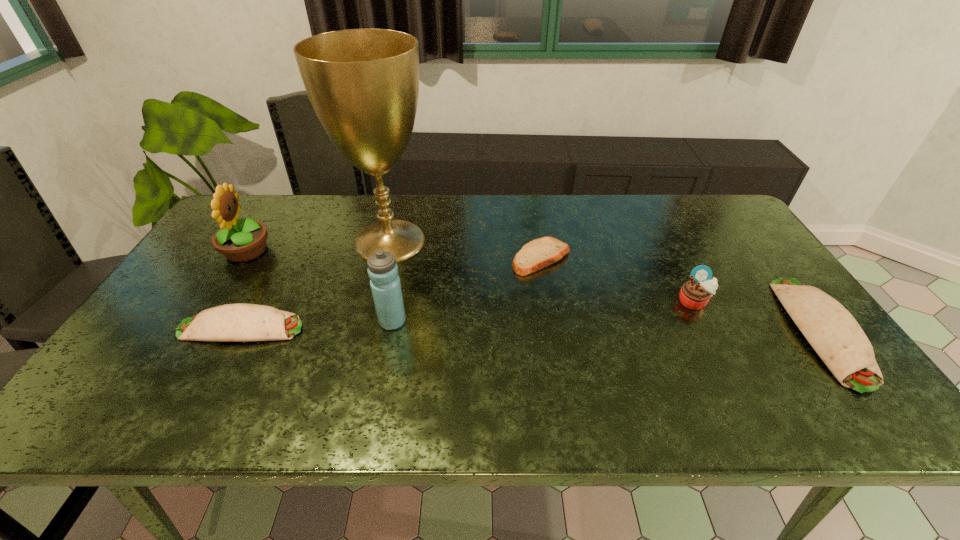
At what (x,y) coordinates should I click in order to perform the action: click on burrito that is at the left edge. Please return your answer as a coordinate pair (x, y). Looking at the image, I should click on 236,322.

Locate an element on the screen. The width and height of the screenshot is (960, 540). sunflower that is at the left edge is located at coordinates (238, 240).

Find the location of a particular element. object situated at the right edge is located at coordinates (835, 335).

At what (x,y) coordinates should I click in order to perform the action: click on object that is at the far left corner. Please return your answer as a coordinate pair (x, y). The height and width of the screenshot is (540, 960). Looking at the image, I should click on (238, 240).

This screenshot has width=960, height=540. I want to click on object situated at the near right corner, so click(835, 335).

Where is `free region at the far edge of the desktop`? This screenshot has height=540, width=960. free region at the far edge of the desktop is located at coordinates (372, 211).

In the image, there is a desktop. Identify the location of vacant space at the near edge. (654, 384).

This screenshot has width=960, height=540. In the image, there is a desktop. Identify the location of vacant space at the left edge. (195, 345).

Locate an element on the screen. The image size is (960, 540). vacant space at the right edge of the desktop is located at coordinates (732, 239).

At what (x,y) coordinates should I click in order to perform the action: click on free location at the far right corner. Please return your answer as a coordinate pair (x, y). This screenshot has height=540, width=960. Looking at the image, I should click on 707,235.